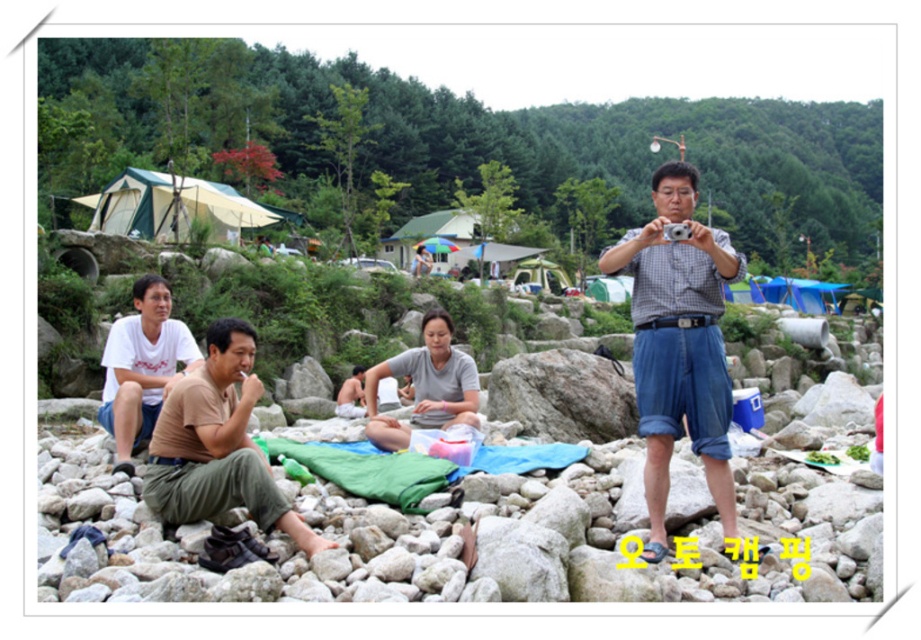
You are standing in the camping area and want to place a small flag at the point that is closer to you. Which point should you choose between point (154, 452) and point (108, 362)?

Point (154, 452) is closer to the viewer than point (108, 362), so you should choose point (154, 452) to place the small flag.

Based on the photo, you are a photographer trying to capture a group photo of the people in the camping area. You notice two individuals wearing shirts labeled as checkered fabric shirt at center and white cotton shirt at left. Based on their positions, which shirt is positioned higher in the image?

The checkered fabric shirt at center is taller than the white cotton shirt at left, so the checkered fabric shirt at center is positioned higher in the image.

You are a photographer trying to capture a group photo of the people in the camping area. You notice the checkered fabric shirt at center and the brown cotton shirt at lower left. Which shirt is covering part of the other in the image?

The checkered fabric shirt at center is positioned over brown cotton shirt at lower left, meaning it is covering part of the brown cotton shirt at lower left in the image.